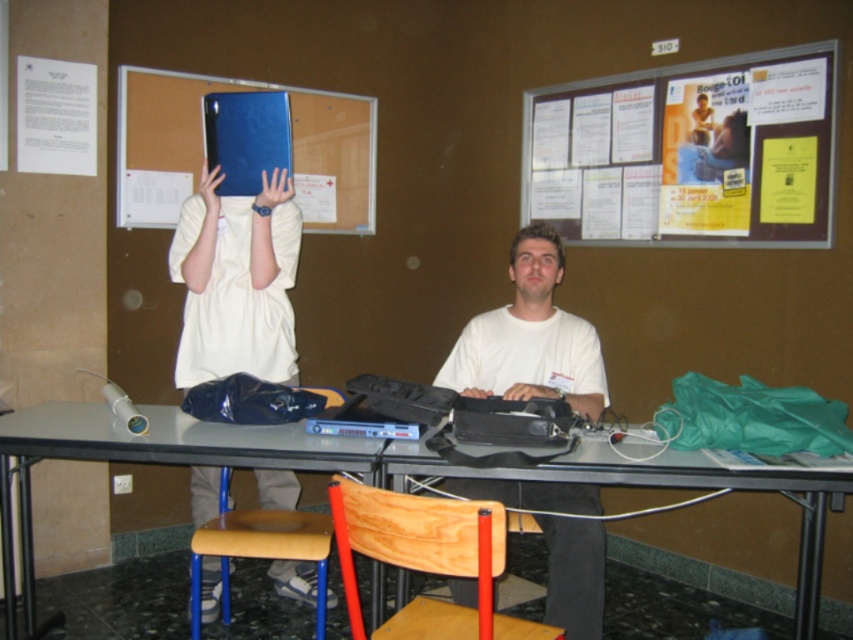
Where is the matte gray table at center located in the image?

The matte gray table at center is located at point 0.689 on the x axis and 0.205 on the y axis.

You are standing in the classroom and notice both the yellow paper poster at upper center and the white matte shirt at center. Which object is located higher up in the image?

The yellow paper poster at upper center is positioned over the white matte shirt at center, meaning it is higher up.

You are standing at the edge of the table in the classroom. You see two points marked on the table surface. The first point is at coordinate point (370, 515) and the second point is at coordinate point (215, 541). If you were to walk towards the second point, would you pass by the first point before reaching it?

Yes, because point (370, 515) is in front of point (215, 541), so walking towards the second point would require passing the first point first.